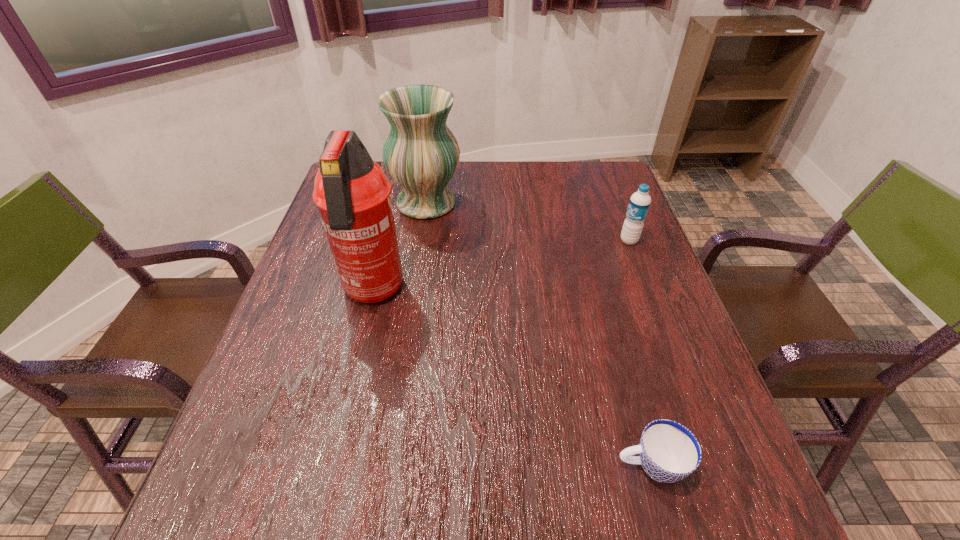
Where is `free space located on the label of the water bottle`? The width and height of the screenshot is (960, 540). free space located on the label of the water bottle is located at coordinates (478, 240).

Locate an element on the screen. blank area located on the label of the water bottle is located at coordinates (556, 240).

This screenshot has height=540, width=960. What are the coordinates of `free region located on the label of the water bottle` in the screenshot? It's located at (482, 240).

This screenshot has height=540, width=960. What are the coordinates of `free space located 0.120m on the side of the nearest object with the handle` in the screenshot? It's located at (545, 465).

You are a GUI agent. You are given a task and a screenshot of the screen. Output one action in this format:
    pyautogui.click(x=<x>, y=<y>)
    Task: Click on the vacant space located 0.120m on the side of the nearest object with the handle
    The height and width of the screenshot is (540, 960).
    Given the screenshot: What is the action you would take?
    pyautogui.click(x=545, y=465)

Where is `free space located on the side of the nearest object with the handle`? The width and height of the screenshot is (960, 540). free space located on the side of the nearest object with the handle is located at coordinates (469, 465).

This screenshot has width=960, height=540. I want to click on object at the far edge, so click(421, 154).

You are a GUI agent. You are given a task and a screenshot of the screen. Output one action in this format:
    pyautogui.click(x=<x>, y=<y>)
    Task: Click on the object present at the near edge
    This screenshot has height=540, width=960.
    Given the screenshot: What is the action you would take?
    pyautogui.click(x=669, y=452)

Image resolution: width=960 pixels, height=540 pixels. In order to click on object that is at the left edge in this screenshot , I will do `click(352, 193)`.

Locate an element on the screen. The image size is (960, 540). water bottle located in the right edge section of the desktop is located at coordinates (640, 201).